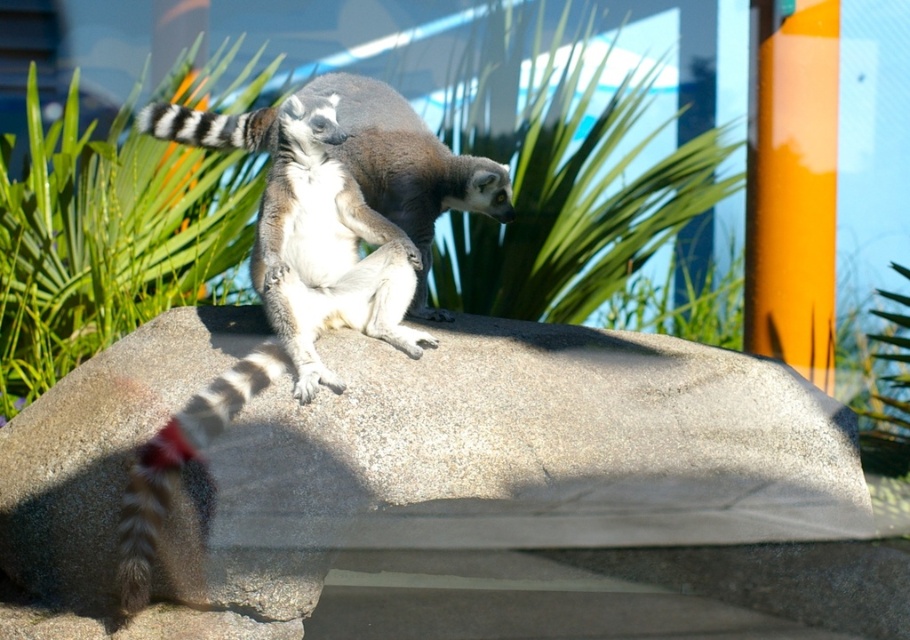
Question: Can you confirm if gray granite boulder at center is smaller than ring-tailed lemur at center?

Choices:
 (A) yes
 (B) no

Answer: (B)

Question: Considering the relative positions of gray granite boulder at center and ring-tailed lemur at center in the image provided, where is gray granite boulder at center located with respect to ring-tailed lemur at center?

Choices:
 (A) right
 (B) left

Answer: (A)

Question: Is gray granite boulder at center positioned behind ring-tailed lemur at center?

Choices:
 (A) no
 (B) yes

Answer: (B)

Question: Which point is closer to the camera?

Choices:
 (A) gray granite boulder at center
 (B) ring-tailed lemur at center

Answer: (B)

Question: Which point is closer to the camera taking this photo?

Choices:
 (A) (159, 490)
 (B) (258, 451)
 (C) (226, 122)

Answer: (A)

Question: Which of the following is the closest to the observer?

Choices:
 (A) (379, 330)
 (B) (651, 476)

Answer: (A)